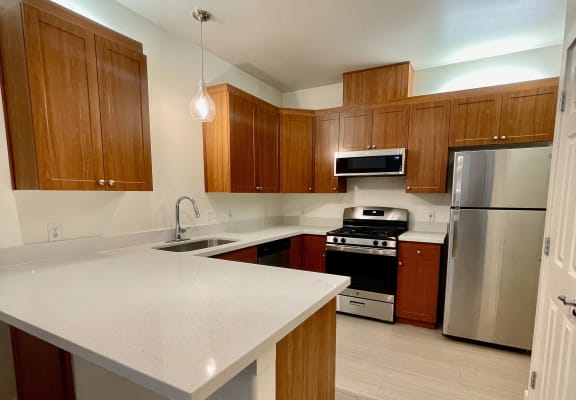
Locate an element on the screen. refrigerator is located at coordinates [x=506, y=256].